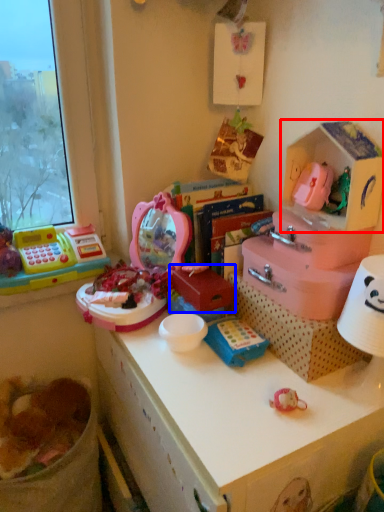
Question: Among these objects, which one is nearest to the camera, storage box (highlighted by a red box) or box (highlighted by a blue box)?

Choices:
 (A) storage box
 (B) box

Answer: (A)